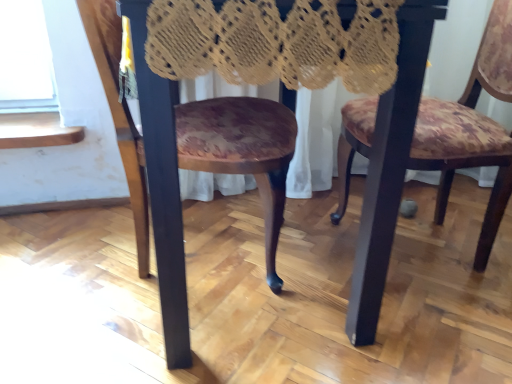
This screenshot has height=384, width=512. In order to click on empty space that is in between floral fabric chair at center, marked as the second chair in a left-to-right arrangement, and wooden table at center in this screenshot , I will do 397,293.